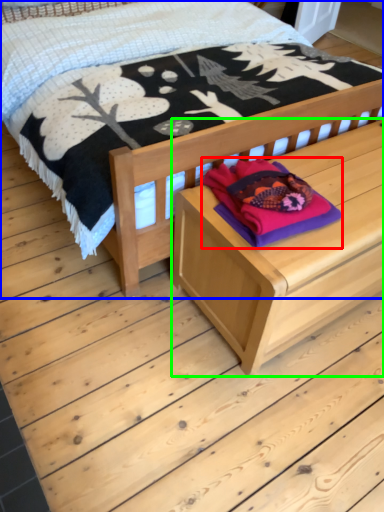
Question: Which is farther away from clothing (highlighted by a red box)? bed (highlighted by a blue box) or table (highlighted by a green box)?

Choices:
 (A) bed
 (B) table

Answer: (A)